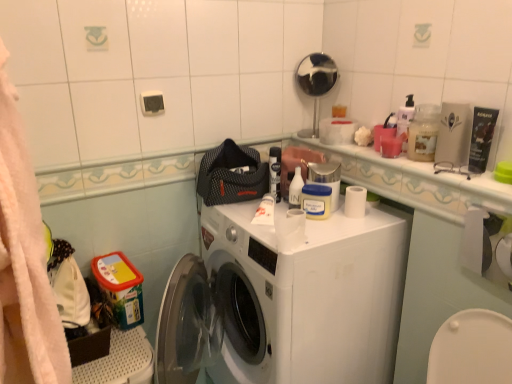
The height and width of the screenshot is (384, 512). What are the coordinates of `vacant area that lies in front of yellow matte jar at center, which is counted as the 4th toiletry, starting from the right` in the screenshot? It's located at (327, 231).